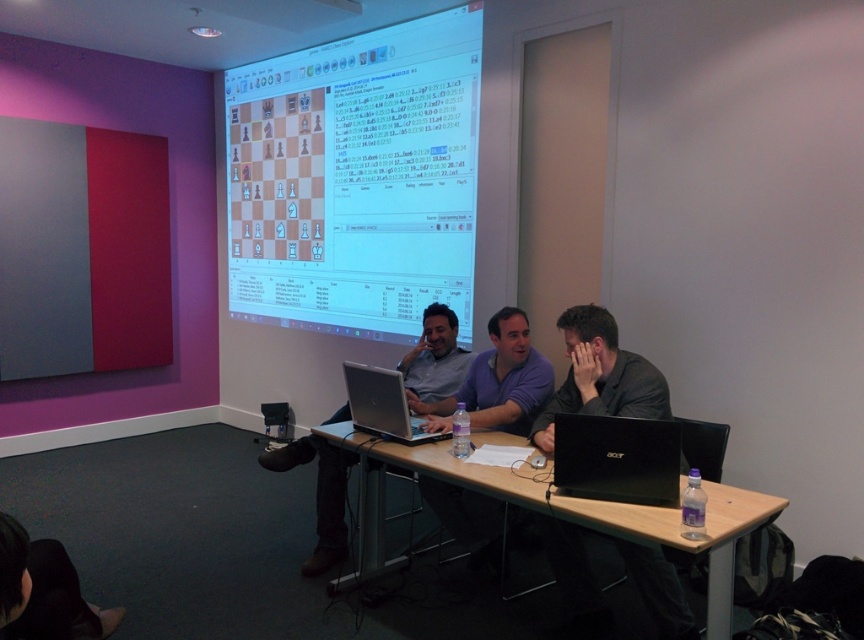
Who is lower down, wooden table at center or black matte laptop at lower right?

Positioned lower is wooden table at center.

You are a GUI agent. You are given a task and a screenshot of the screen. Output one action in this format:
    pyautogui.click(x=<x>, y=<y>)
    Task: Click on the wooden table at center
    
    Given the screenshot: What is the action you would take?
    pyautogui.click(x=592, y=508)

The image size is (864, 640). In order to click on wooden table at center in this screenshot , I will do `click(592, 508)`.

Does point (570, 552) lie behind point (551, 420)?

No.

Can you confirm if black matte jacket at center is positioned above black matte laptop at lower right?

Yes, black matte jacket at center is above black matte laptop at lower right.

You are a GUI agent. You are given a task and a screenshot of the screen. Output one action in this format:
    pyautogui.click(x=<x>, y=<y>)
    Task: Click on the black matte jacket at center
    
    Given the screenshot: What is the action you would take?
    pyautogui.click(x=600, y=376)

This screenshot has height=640, width=864. Find the location of `black matte jacket at center`. black matte jacket at center is located at coordinates (600, 376).

Which is more to the left, wooden table at center or black matte jacket at center?

From the viewer's perspective, wooden table at center appears more on the left side.

Between point (596, 525) and point (576, 376), which one is positioned behind?

The point (576, 376) is more distant.

Find the location of a particular element. Image resolution: width=864 pixels, height=640 pixels. wooden table at center is located at coordinates (592, 508).